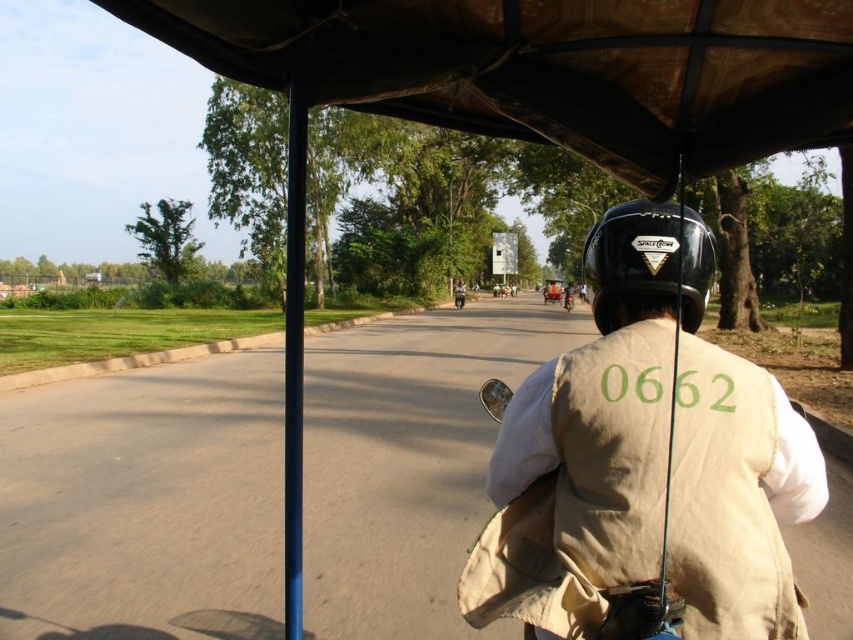
You are a passenger in the motorized rickshaw and want to know if the beige fabric vest at center can fit into a bag that can only hold items narrower than the black matte helmet at center. Can it?

The beige fabric vest at center is wider than the black matte helmet at center, so it cannot fit into the bag designed for items narrower than the helmet.

You are a passenger in the motorized rickshaw and notice two items on the driver. Which item has a larger size between the beige fabric vest at center and the black matte helmet at center?

The beige fabric vest at center is bigger than the black matte helmet at center.

You are a passenger in the motorized rickshaw and want to hand something to the driver. Which object, the beige fabric vest at center or the black matte helmet at center, is closer to you as you reach forward?

The beige fabric vest at center is closer to the viewer than the black matte helmet at center, so you should reach for the beige fabric vest at center first.